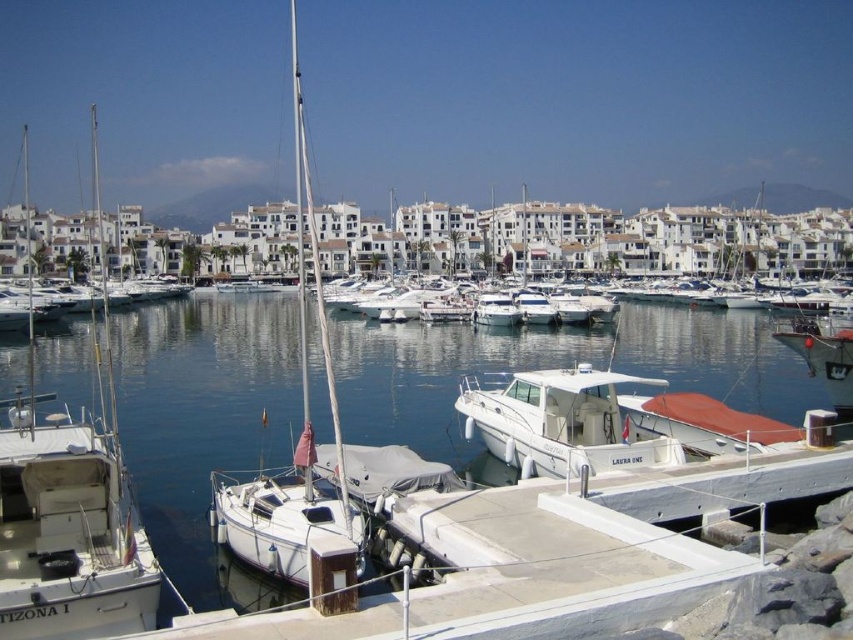
Question: Is white matte sailboat at center above clear blue water at center?

Choices:
 (A) no
 (B) yes

Answer: (B)

Question: Which point is closer to the camera?

Choices:
 (A) clear blue water at center
 (B) white matte sailboat at center
 (C) white matte sailboat at left
 (D) white glossy motorboat at center

Answer: (C)

Question: Is white matte sailboat at left to the left of white glossy motorboat at center from the viewer's perspective?

Choices:
 (A) yes
 (B) no

Answer: (A)

Question: Which point is farther from the camera taking this photo?

Choices:
 (A) (709, 449)
 (B) (354, 557)
 (C) (722, 442)

Answer: (A)

Question: Which point appears closest to the camera in this image?

Choices:
 (A) (544, 385)
 (B) (376, 504)
 (C) (68, 556)

Answer: (C)

Question: Is white matte sailboat at left to the right of clear blue water at center from the viewer's perspective?

Choices:
 (A) yes
 (B) no

Answer: (B)